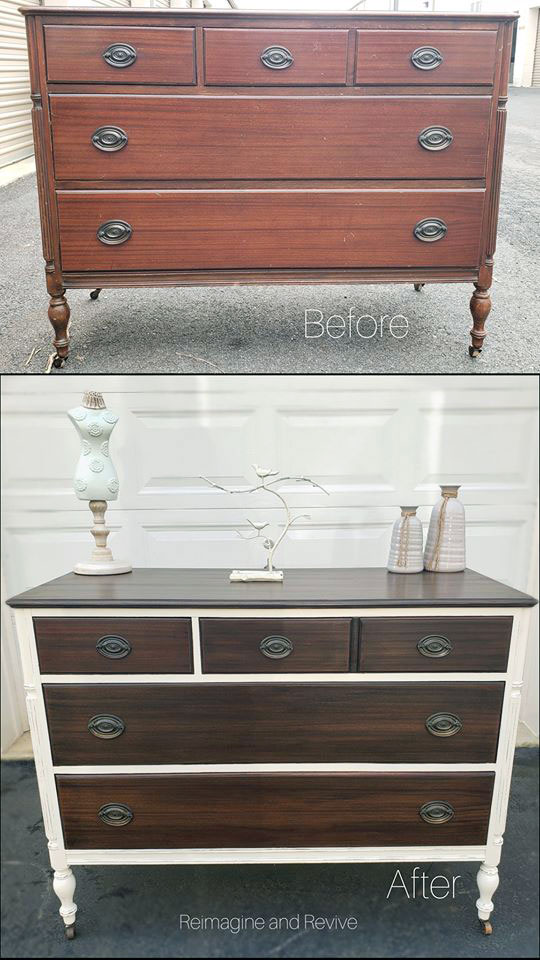
Identify the location of drawer legs. This screenshot has width=540, height=960. (476, 309), (57, 315), (94, 293), (420, 290), (488, 890), (62, 883).